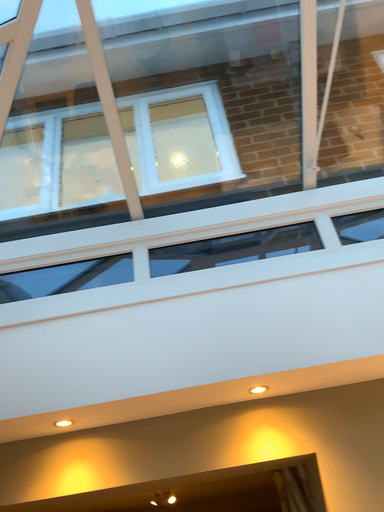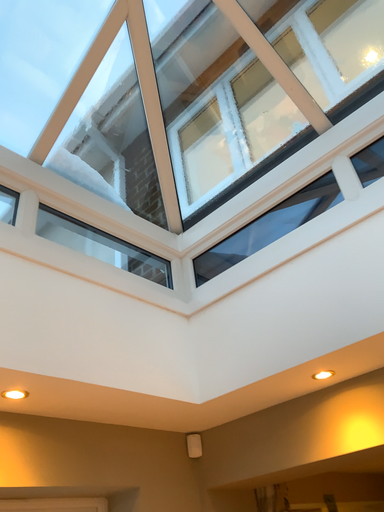
Question: How did the camera likely rotate when shooting the video?

Choices:
 (A) rotated left
 (B) rotated right

Answer: (A)